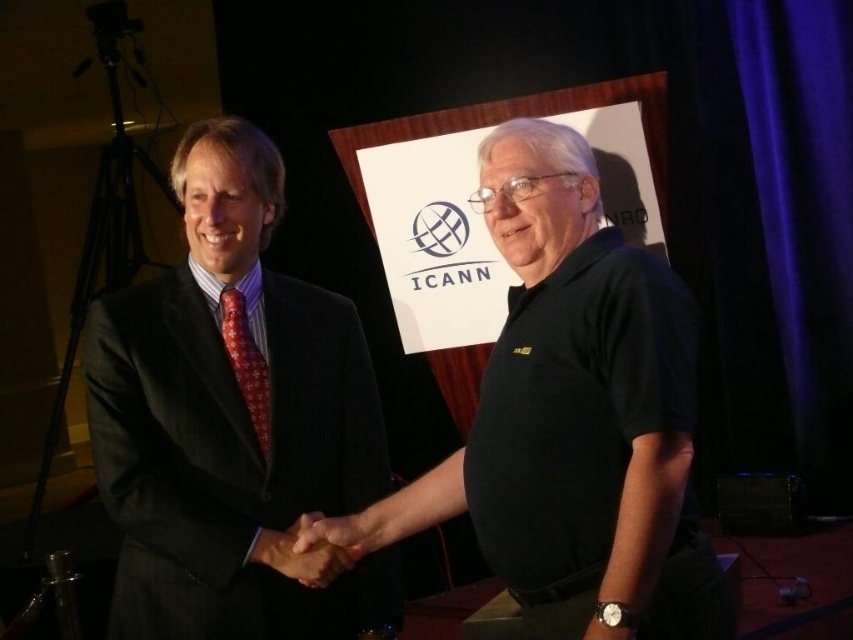
You are a photographer at the event and need to ensure that both the black cotton polo shirt at center and the matte black hand at center are clearly visible in the photo. Given their size difference, which object should you focus on to ensure both are in frame without cropping?

The black cotton polo shirt at center is larger in size than the matte black hand at center, so focusing on the larger object, the black cotton polo shirt at center, will ensure both are visible without cropping.

Looking at this image, you are a photographer at the event and need to ensure that both the black cotton polo shirt at center and the matte black hand at center are clearly visible in the photo. Based on their positions, which one is positioned higher in the frame?

The black cotton polo shirt at center is taller than the matte black hand at center, so it is positioned higher in the frame.

You are a photographer at the event and need to capture a closeup of both the smooth skin handshake at center and the matte black hand at center. Since you can only focus on one subject at a time, which hand should you focus on to ensure the other is in the background?

You should focus on the smooth skin handshake at center because it is closer to you than the matte black hand at center, so the latter will be in the background.